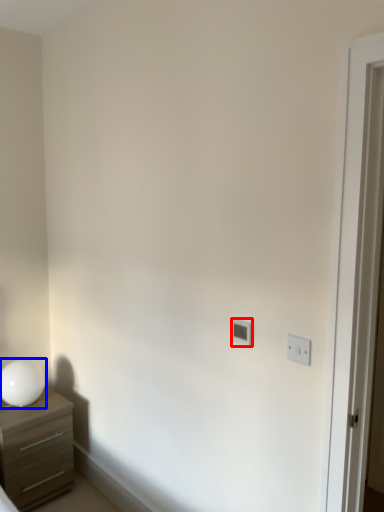
Question: Which object appears closest to the camera in this image, light switch (highlighted by a red box) or table lamp (highlighted by a blue box)?

Choices:
 (A) light switch
 (B) table lamp

Answer: (A)